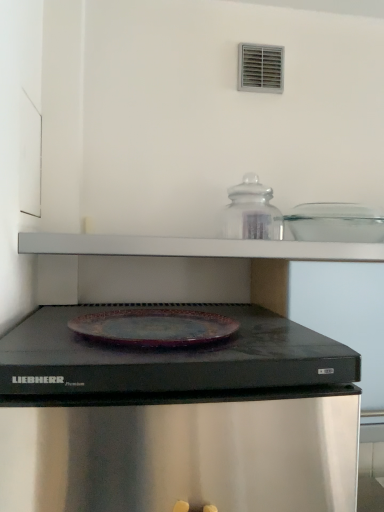
Question: Is clear glass jar at upper center, the 1th appliance from the right, a part of transparent glass jar at upper center, the 1th appliance positioned from the left?

Choices:
 (A) no
 (B) yes

Answer: (A)

Question: Considering the relative sizes of transparent glass jar at upper center, placed as the second appliance when sorted from right to left, and clear glass jar at upper center, the 1th appliance from the right, in the image provided, is transparent glass jar at upper center, placed as the second appliance when sorted from right to left, bigger than clear glass jar at upper center, the 1th appliance from the right,?

Choices:
 (A) yes
 (B) no

Answer: (B)

Question: Could you tell me if transparent glass jar at upper center, the 1th appliance positioned from the left, is turned towards clear glass jar at upper center, which is the second appliance from left to right?

Choices:
 (A) yes
 (B) no

Answer: (B)

Question: From a real-world perspective, is transparent glass jar at upper center, the 1th appliance positioned from the left, under clear glass jar at upper center, the 1th appliance from the right?

Choices:
 (A) yes
 (B) no

Answer: (B)

Question: Is transparent glass jar at upper center, the 1th appliance positioned from the left, smaller than clear glass jar at upper center, the 1th appliance from the right?

Choices:
 (A) yes
 (B) no

Answer: (A)

Question: Can you confirm if transparent glass jar at upper center, placed as the second appliance when sorted from right to left, is shorter than clear glass jar at upper center, which is the second appliance from left to right?

Choices:
 (A) no
 (B) yes

Answer: (A)

Question: Is clear glass jar at upper center, which is the second appliance from left to right, oriented towards transparent glass jar at upper center, placed as the second appliance when sorted from right to left?

Choices:
 (A) no
 (B) yes

Answer: (A)

Question: Can you confirm if clear glass jar at upper center, the 1th appliance from the right, is shorter than transparent glass jar at upper center, the 1th appliance positioned from the left?

Choices:
 (A) yes
 (B) no

Answer: (A)

Question: Is clear glass jar at upper center, the 1th appliance from the right, next to transparent glass jar at upper center, placed as the second appliance when sorted from right to left?

Choices:
 (A) yes
 (B) no

Answer: (B)

Question: Can you confirm if clear glass jar at upper center, the 1th appliance from the right, is thinner than transparent glass jar at upper center, placed as the second appliance when sorted from right to left?

Choices:
 (A) no
 (B) yes

Answer: (A)

Question: From the image's perspective, is clear glass jar at upper center, which is the second appliance from left to right, on top of transparent glass jar at upper center, placed as the second appliance when sorted from right to left?

Choices:
 (A) no
 (B) yes

Answer: (A)

Question: Is clear glass jar at upper center, which is the second appliance from left to right, smaller than transparent glass jar at upper center, placed as the second appliance when sorted from right to left?

Choices:
 (A) yes
 (B) no

Answer: (B)

Question: Considering the positions of transparent glass jar at upper center, the 1th appliance positioned from the left, and clear glass jar at upper center, the 1th appliance from the right, in the image, is transparent glass jar at upper center, the 1th appliance positioned from the left, wider or thinner than clear glass jar at upper center, the 1th appliance from the right,?

Choices:
 (A) thin
 (B) wide

Answer: (A)